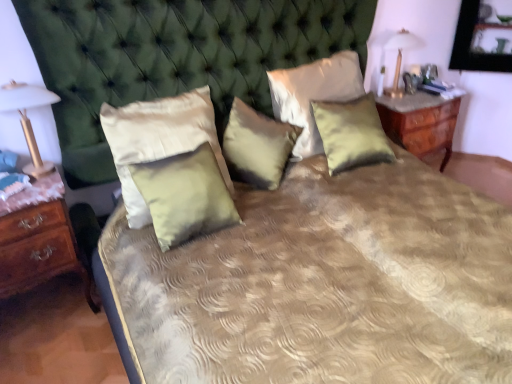
Question: Can you confirm if satin green pillow at center, placed as the 2th pillow when sorted from left to right, is bigger than gold metallic lampshade at left, arranged as the first bedside lamp when viewed from the front?

Choices:
 (A) yes
 (B) no

Answer: (A)

Question: Is gold metallic lampshade at left, the second bedside lamp when ordered from right to left, inside satin green pillow at center, placed as the 2th pillow when sorted from left to right?

Choices:
 (A) yes
 (B) no

Answer: (B)

Question: Is satin green pillow at center, placed as the 2th pillow when sorted from left to right, facing away from gold metallic lampshade at left, which appears as the second bedside lamp when viewed from the back?

Choices:
 (A) yes
 (B) no

Answer: (B)

Question: Is satin green pillow at center, placed as the 2th pillow when sorted from left to right, further to the viewer compared to gold metallic lampshade at left, the second bedside lamp when ordered from right to left?

Choices:
 (A) no
 (B) yes

Answer: (B)

Question: Are satin green pillow at center, placed as the 2th pillow when sorted from left to right, and gold metallic lampshade at left, which appears as the second bedside lamp when viewed from the back, making contact?

Choices:
 (A) no
 (B) yes

Answer: (A)

Question: Is satin green pillow at center, which is the 3th pillow in right-to-left order, spatially inside gold metallic lampshade at left, which appears as the second bedside lamp when viewed from the back, or outside of it?

Choices:
 (A) outside
 (B) inside

Answer: (A)

Question: From their relative heights in the image, would you say satin green pillow at center, which appears as the third pillow when viewed from the left, is taller or shorter than gold metallic lampshade at left, which appears as the second bedside lamp when viewed from the back?

Choices:
 (A) short
 (B) tall

Answer: (A)

Question: Relative to gold metallic lampshade at left, arranged as the first bedside lamp when viewed from the front, is satin green pillow at center, which appears as the third pillow when viewed from the left, in front or behind?

Choices:
 (A) front
 (B) behind

Answer: (B)

Question: Does point (282, 122) appear closer or farther from the camera than point (32, 163)?

Choices:
 (A) closer
 (B) farther

Answer: (B)

Question: Is gold metallic lampshade at left, acting as the first bedside lamp starting from the left, inside the boundaries of brown wood nightstand at left, placed as the first nightstand when sorted from front to back, or outside?

Choices:
 (A) outside
 (B) inside

Answer: (A)

Question: Is point (31, 162) closer or farther from the camera than point (67, 236)?

Choices:
 (A) farther
 (B) closer

Answer: (A)

Question: Based on their positions, is gold metallic lampshade at left, which appears as the second bedside lamp when viewed from the back, located to the left or right of brown wood nightstand at left, arranged as the second nightstand when viewed from the top?

Choices:
 (A) left
 (B) right

Answer: (B)

Question: Is gold metallic lampshade at left, which appears as the second bedside lamp when viewed from the back, bigger or smaller than brown wood nightstand at left, placed as the first nightstand when sorted from front to back?

Choices:
 (A) big
 (B) small

Answer: (B)

Question: Is satin yellow pillow at center, the first pillow positioned from the right, to the left or to the right of gold metallic lampshade at upper right, arranged as the 1th bedside lamp when viewed from the back, in the image?

Choices:
 (A) left
 (B) right

Answer: (A)

Question: Considering the positions of satin yellow pillow at center, which appears as the 5th pillow when viewed from the left, and gold metallic lampshade at upper right, which is the 1th bedside lamp from top to bottom, in the image, is satin yellow pillow at center, which appears as the 5th pillow when viewed from the left, bigger or smaller than gold metallic lampshade at upper right, which is the 1th bedside lamp from top to bottom,?

Choices:
 (A) small
 (B) big

Answer: (B)